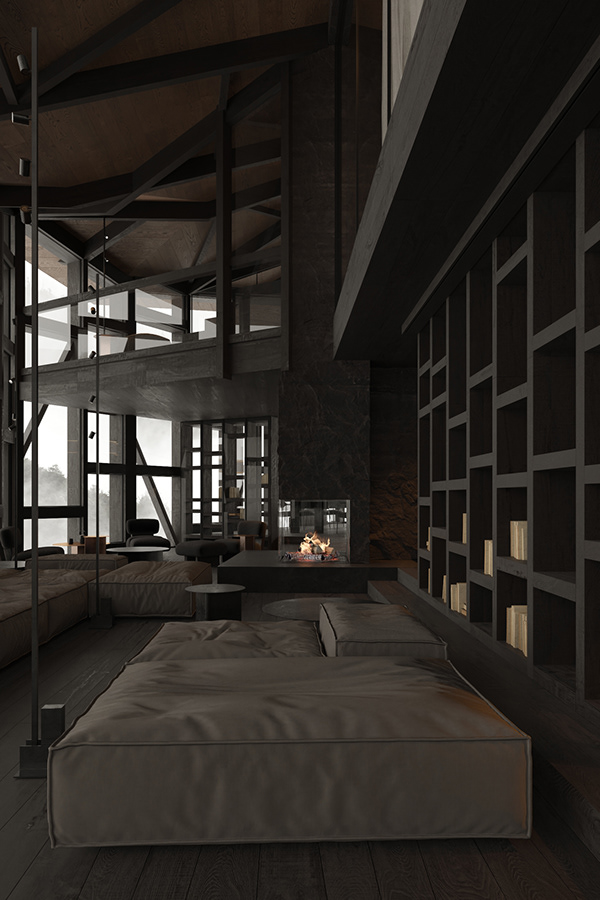
Locate an element on the screen. glass windows is located at coordinates (59, 459), (161, 439), (51, 280), (51, 532), (101, 514), (165, 491), (196, 482), (167, 310), (107, 307), (198, 315).